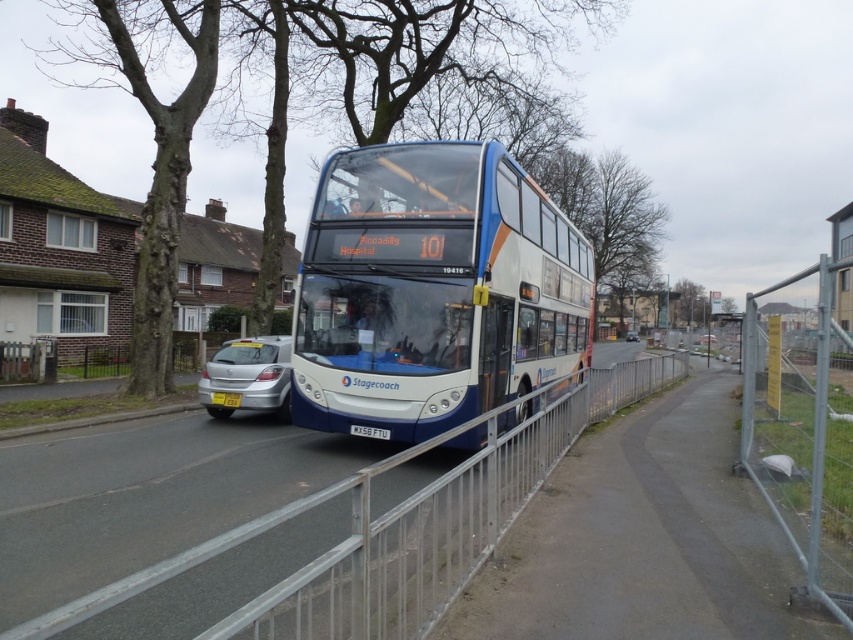
You are a pedestrian standing on the sidewalk near the silver metallic sedan at lower left. You want to look up to see the brown bark tree at upper center. Which direction should you look?

The brown bark tree at upper center is above the silver metallic sedan at lower left, so you should look upward to see it.

You are a pedestrian standing at the bus stop near the brown bark tree at upper center and the silver metallic sedan at lower left. You want to cross the road to the residential area on the left. Which object should you use as a reference to ensure you cross safely?

You should use the brown bark tree at upper center as a reference because it is positioned on the left side of the silver metallic sedan at lower left, indicating the direction towards the residential area.

You are standing at the point marked by the coordinates (x=247, y=376) in the image. Describe your surroundings as you look towards the double decker bus in the foreground.

The point marked by the coordinates (x=247, y=376) indicates a silver metallic sedan at lower left. Looking towards the double decker bus in the foreground, you would see the bus positioned in front of residential buildings with brick houses and chimneys to the left side of the road.